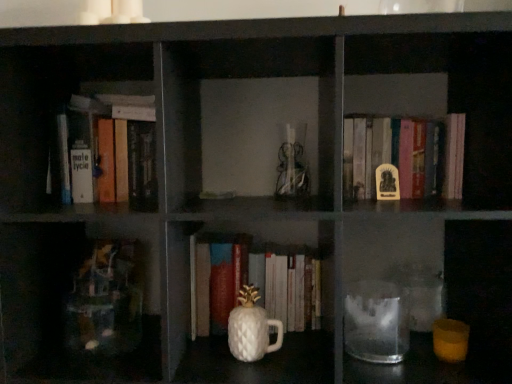
Where is `vacant space situated above yellow matte statue at center, which is the 1th book from right to left (from a real-world perspective)`? vacant space situated above yellow matte statue at center, which is the 1th book from right to left (from a real-world perspective) is located at coordinates (381, 114).